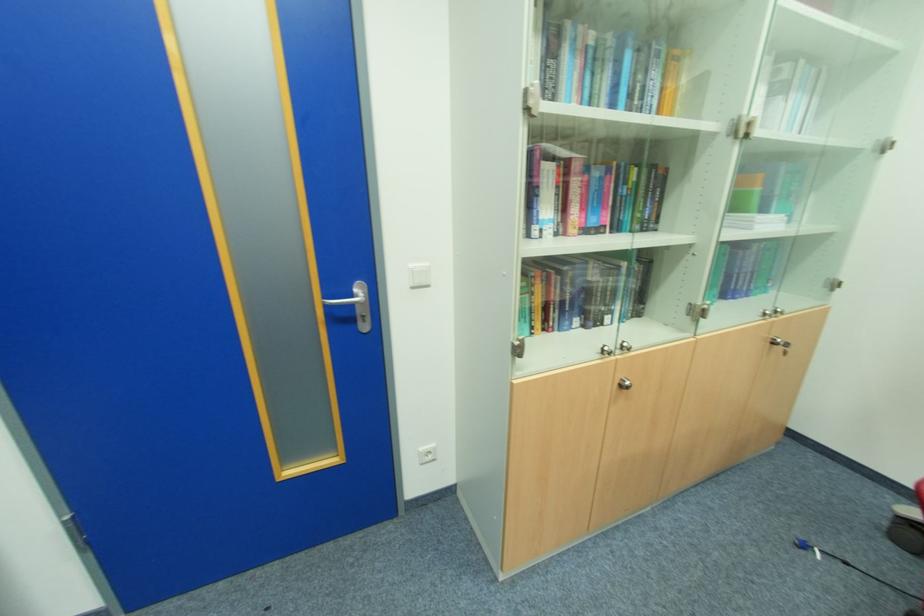
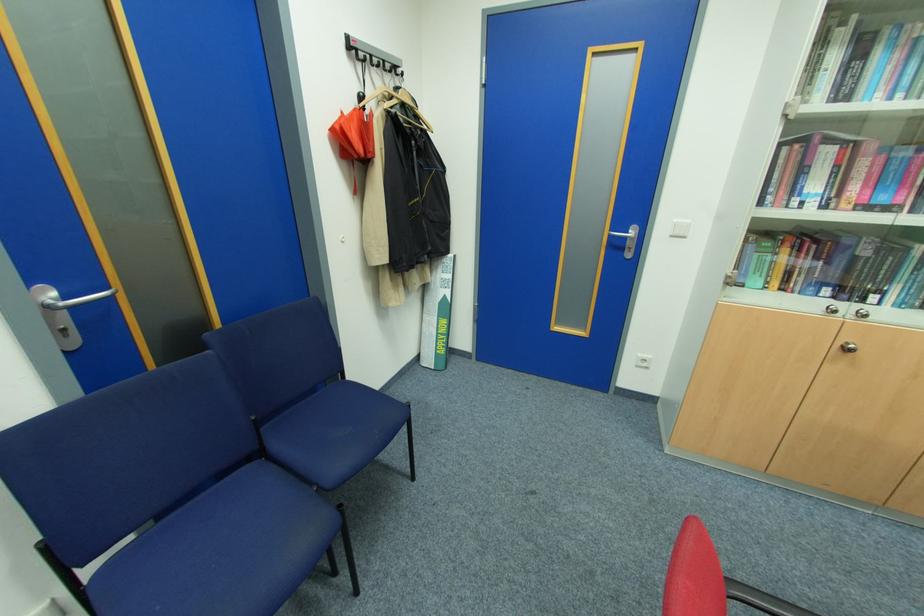
In the second image, find the point that corresponds to pixel 417 288 in the first image.

(675, 236)